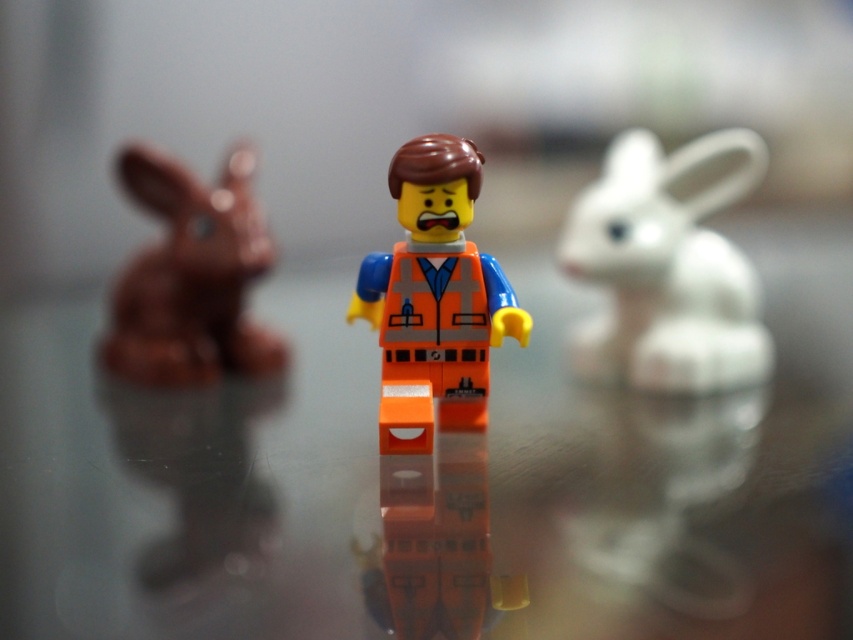
You are a photographer standing 1.5 meters away from the camera. You want to take a photo of the white matte rabbit at right. Can you reach the camera to adjust it without moving your position?

The white matte rabbit at right and camera are 1.40 meters apart. Since you are 1.5 meters away from the camera, you can reach the camera to adjust it as you are close enough.

You are a LEGO minifigure standing at point (120, 180) and want to move to the glass table where the other minifigure is standing at point (691, 353). Is the glass table in front of or behind you?

The glass table at point (691, 353) is in front of you because point (691, 353) is in front of point (120, 180).